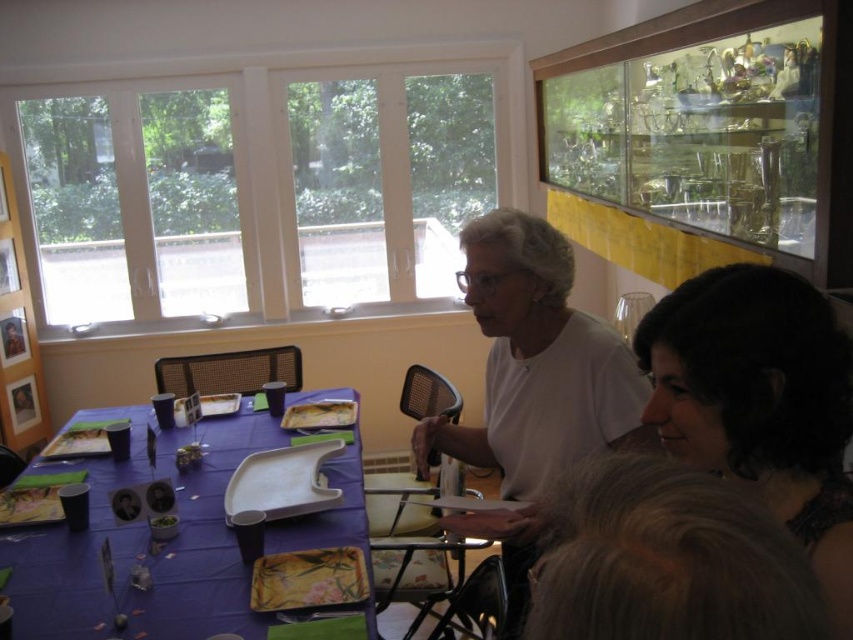
Question: Is dark brown hair at upper right further to the viewer compared to purple fabric table at lower left?

Choices:
 (A) no
 (B) yes

Answer: (A)

Question: Which point is farther from the camera taking this photo?

Choices:
 (A) (178, 628)
 (B) (717, 417)

Answer: (A)

Question: Is the position of dark brown hair at upper right more distant than that of purple fabric table at lower left?

Choices:
 (A) no
 (B) yes

Answer: (A)

Question: Does dark brown hair at upper right appear over purple fabric table at lower left?

Choices:
 (A) yes
 (B) no

Answer: (A)